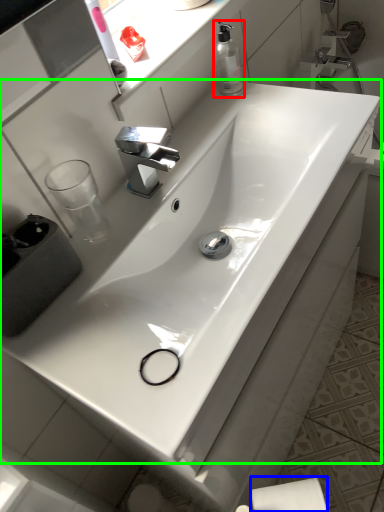
Question: Estimate the real-world distances between objects in this image. Which object is farther from soap dispenser (highlighted by a red box), toilet paper (highlighted by a blue box) or sink (highlighted by a green box)?

Choices:
 (A) toilet paper
 (B) sink

Answer: (A)